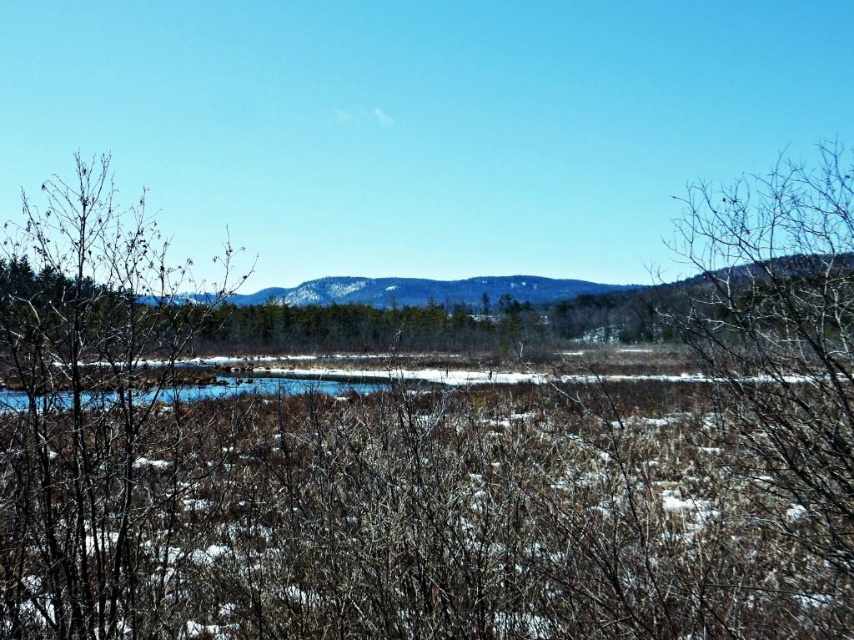
Question: Does bare branches at left appear over brown textured branches at right?

Choices:
 (A) yes
 (B) no

Answer: (B)

Question: Can you confirm if bare branches at left is positioned to the right of brown textured branches at right?

Choices:
 (A) no
 (B) yes

Answer: (A)

Question: Which point is farther to the camera?

Choices:
 (A) (829, 208)
 (B) (63, 627)

Answer: (B)

Question: Does bare branches at left lie behind brown textured branches at right?

Choices:
 (A) no
 (B) yes

Answer: (B)

Question: Which point is farther to the camera?

Choices:
 (A) [x=34, y=301]
 (B) [x=782, y=376]

Answer: (A)